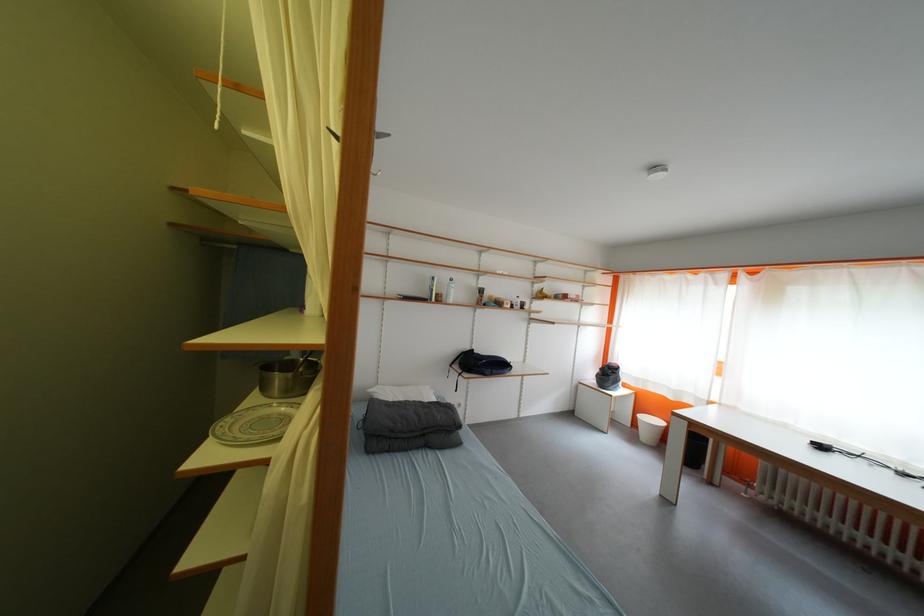
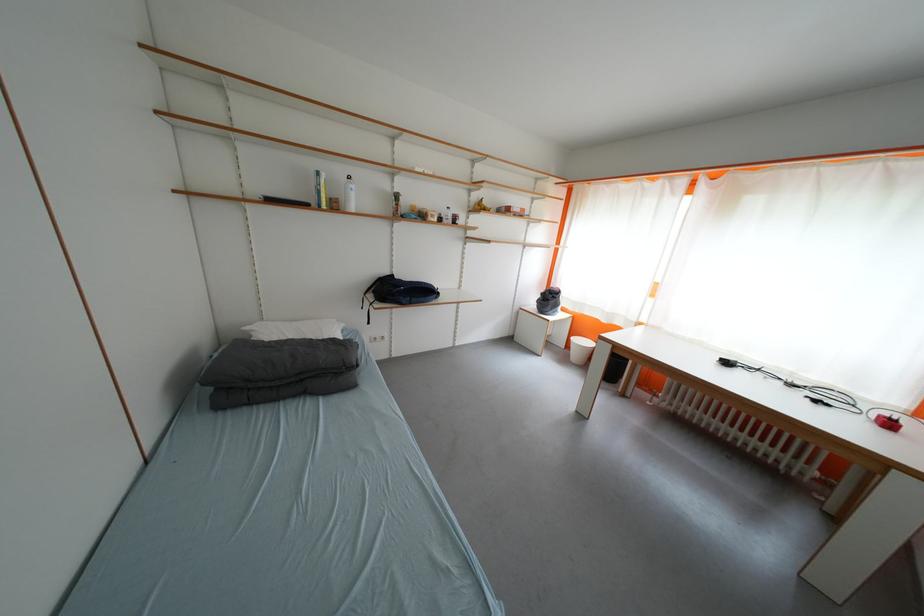
Question: Based on the continuous images, in which direction is the camera rotating? Reply with the corresponding letter.

Choices:
 (A) Left
 (B) Right
 (C) Up
 (D) Down

Answer: (D)